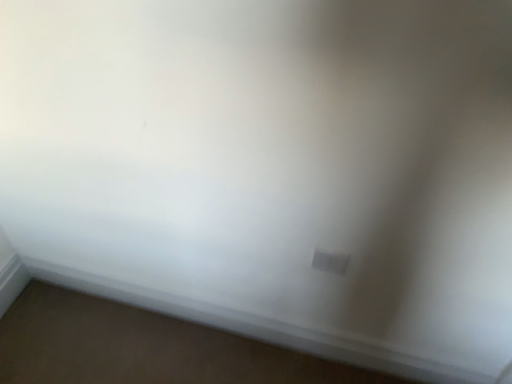
The width and height of the screenshot is (512, 384). What do you see at coordinates (256, 326) in the screenshot?
I see `white smooth baseboard at lower center` at bounding box center [256, 326].

Find the location of a particular element. The height and width of the screenshot is (384, 512). white smooth baseboard at lower center is located at coordinates (256, 326).

What is the approximate height of white smooth baseboard at lower center?

white smooth baseboard at lower center is 6.35 inches in height.

Measure the distance between point [327,268] and camera.

The depth of point [327,268] is 3.68 feet.

What do you see at coordinates (330, 262) in the screenshot?
I see `white plastic electric outlet at lower right` at bounding box center [330, 262].

Identify the location of white plastic electric outlet at lower right. (330, 262).

The width and height of the screenshot is (512, 384). In order to click on white smooth baseboard at lower center in this screenshot , I will do `click(256, 326)`.

Can you confirm if white smooth baseboard at lower center is positioned to the right of white plastic electric outlet at lower right?

No, white smooth baseboard at lower center is not to the right of white plastic electric outlet at lower right.

From the picture: Relative to white plastic electric outlet at lower right, is white smooth baseboard at lower center in front or behind?

white smooth baseboard at lower center is behind white plastic electric outlet at lower right.

Which is less distant, (468, 379) or (337, 274)?

Point (468, 379) appears to be farther away from the viewer than point (337, 274).

From the image's perspective, is white smooth baseboard at lower center on white plastic electric outlet at lower right?

Actually, white smooth baseboard at lower center appears below white plastic electric outlet at lower right in the image.

From a real-world perspective, between white smooth baseboard at lower center and white plastic electric outlet at lower right, who is vertically higher?

white plastic electric outlet at lower right.

Does white smooth baseboard at lower center have a greater width compared to white plastic electric outlet at lower right?

Yes, white smooth baseboard at lower center is wider than white plastic electric outlet at lower right.

Is white smooth baseboard at lower center shorter than white plastic electric outlet at lower right?

No.

Is white smooth baseboard at lower center bigger or smaller than white plastic electric outlet at lower right?

Clearly, white smooth baseboard at lower center is larger in size than white plastic electric outlet at lower right.

Which is correct: white smooth baseboard at lower center is inside white plastic electric outlet at lower right, or outside of it?

white smooth baseboard at lower center is not enclosed by white plastic electric outlet at lower right.

Is white smooth baseboard at lower center not near white plastic electric outlet at lower right?

white smooth baseboard at lower center is actually quite close to white plastic electric outlet at lower right.

In the scene shown: Is white smooth baseboard at lower center positioned with its back to white plastic electric outlet at lower right?

white smooth baseboard at lower center does not have its back to white plastic electric outlet at lower right.

Can you tell me how much white smooth baseboard at lower center and white plastic electric outlet at lower right differ in facing direction?

Answer: The facing directions of white smooth baseboard at lower center and white plastic electric outlet at lower right are 0.984 degrees apart.

The height and width of the screenshot is (384, 512). I want to click on electric outlet on the right of the white smooth baseboard at lower center, so click(x=330, y=262).

Does white plastic electric outlet at lower right appear on the right side of white smooth baseboard at lower center?

Correct, you'll find white plastic electric outlet at lower right to the right of white smooth baseboard at lower center.

Which is in front, white plastic electric outlet at lower right or white smooth baseboard at lower center?

white plastic electric outlet at lower right is in front.

Which is further, (334, 273) or (438, 370)?

The point (438, 370) is more distant.

From the image's perspective, which one is positioned lower, white plastic electric outlet at lower right or white smooth baseboard at lower center?

white smooth baseboard at lower center is shown below in the image.

From a real-world perspective, is white plastic electric outlet at lower right positioned over white smooth baseboard at lower center based on gravity?

Yes, from a real-world perspective, white plastic electric outlet at lower right is on top of white smooth baseboard at lower center.

Considering the sizes of white plastic electric outlet at lower right and white smooth baseboard at lower center in the image, is white plastic electric outlet at lower right wider or thinner than white smooth baseboard at lower center?

Clearly, white plastic electric outlet at lower right has less width compared to white smooth baseboard at lower center.

Between white plastic electric outlet at lower right and white smooth baseboard at lower center, which one has more height?

white smooth baseboard at lower center.

In terms of size, does white plastic electric outlet at lower right appear bigger or smaller than white smooth baseboard at lower center?

Clearly, white plastic electric outlet at lower right is smaller in size than white smooth baseboard at lower center.

Can we say white plastic electric outlet at lower right lies outside white smooth baseboard at lower center?

That's correct, white plastic electric outlet at lower right is outside of white smooth baseboard at lower center.

Are white plastic electric outlet at lower right and white smooth baseboard at lower center far apart?

Actually, white plastic electric outlet at lower right and white smooth baseboard at lower center are a little close together.

Does white plastic electric outlet at lower right turn towards white smooth baseboard at lower center?

No, white plastic electric outlet at lower right is not oriented towards white smooth baseboard at lower center.

Can you tell me how much white plastic electric outlet at lower right and white smooth baseboard at lower center differ in facing direction?

The angle between the facing direction of white plastic electric outlet at lower right and the facing direction of white smooth baseboard at lower center is 0.984 degrees.

You are a GUI agent. You are given a task and a screenshot of the screen. Output one action in this format:
    pyautogui.click(x=<x>, y=<y>)
    Task: Click on the electric outlet in front of the white smooth baseboard at lower center
    The height and width of the screenshot is (384, 512).
    Given the screenshot: What is the action you would take?
    pyautogui.click(x=330, y=262)

This screenshot has height=384, width=512. Identify the location of window sill lying below the white plastic electric outlet at lower right (from the image's perspective). click(256, 326).

Locate an element on the screen. Image resolution: width=512 pixels, height=384 pixels. electric outlet in front of the white smooth baseboard at lower center is located at coordinates pyautogui.click(x=330, y=262).